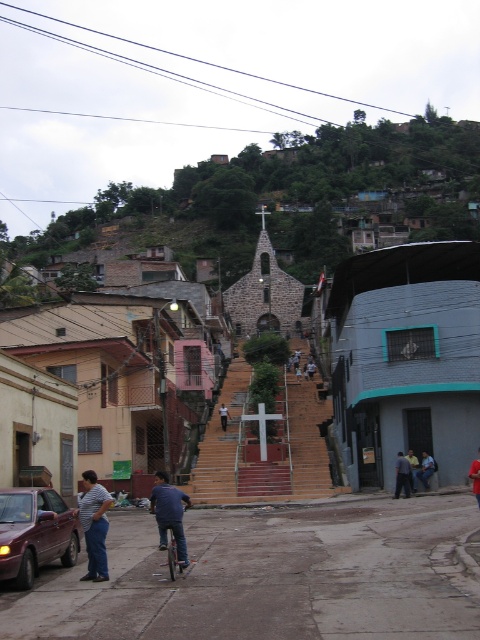
You are a photographer standing at the bottom of the stairs leading to the church. You want to take a photo that includes both the point at coordinates point (175,563) and the point at coordinates point (412,470). Which point will appear larger in your photo?

Point (175,563) will appear larger in the photo because it is closer to the camera than point (412,470).

You are a pedestrian standing at the bottom of the stairs leading to the church. You need to walk to the metallic silver bicycle at center. Will you pass by the matte red car at lower left on your way?

Yes, you will pass by the matte red car at lower left on your way to the metallic silver bicycle at center because the matte red car at lower left is closer to the viewer than the metallic silver bicycle at center.

You are a delivery person carrying a package that is 30 cm wide. You need to pass between the metallic silver bicycle at center and the dark blue shirt at lower right. Which object should you move closer to in order to have enough space for your package?

The metallic silver bicycle at center is thinner than the dark blue shirt at lower right, so you should move closer to the metallic silver bicycle at center to ensure there is enough space for your 30 cm wide package.